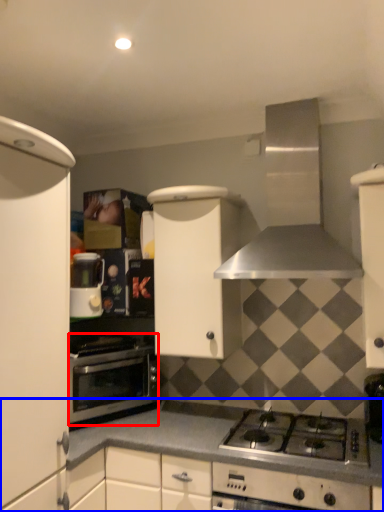
Question: Among these objects, which one is farthest to the camera, oven (highlighted by a red box) or countertop (highlighted by a blue box)?

Choices:
 (A) oven
 (B) countertop

Answer: (A)